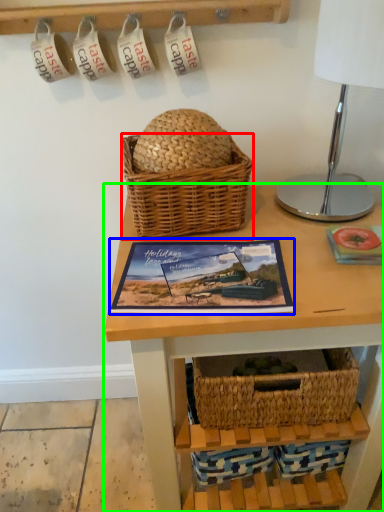
Question: Which is nearer to the picnic basket (highlighted by a red box)? picture frame (highlighted by a blue box) or table (highlighted by a green box).

Choices:
 (A) picture frame
 (B) table

Answer: (A)